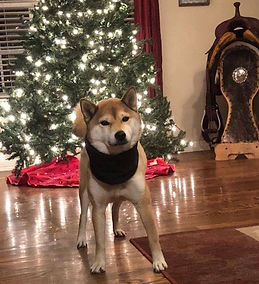
Locate an element on the screen. blinds is located at coordinates (12, 53).